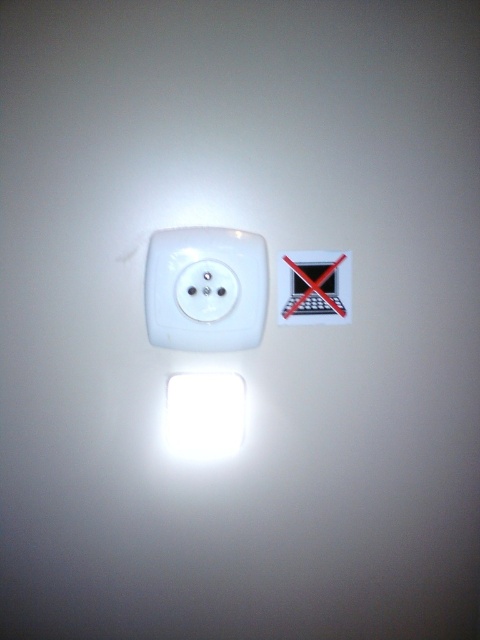
You are holding a 1.5 meter long extension cord and want to plug it into the white glossy electric outlet at center. The outlet is 83.31 centimeters away from you. Can you reach it without moving closer?

The white glossy electric outlet at center is 83.31 centimeters away from you. Since the extension cord is 1.5 meters long, which is longer than the distance, you can easily reach it without moving closer.

You are an electrician checking the wiring in a room. You see the white glossy electric outlet at center and the white glossy light at center. Which one is located higher on the wall?

The white glossy electric outlet at center is positioned over the white glossy light at center, so it is located higher on the wall.